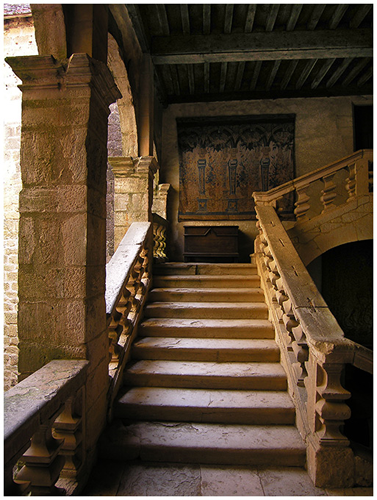
Locate an element on the screen. Image resolution: width=377 pixels, height=500 pixels. cabinet is located at coordinates (219, 249).